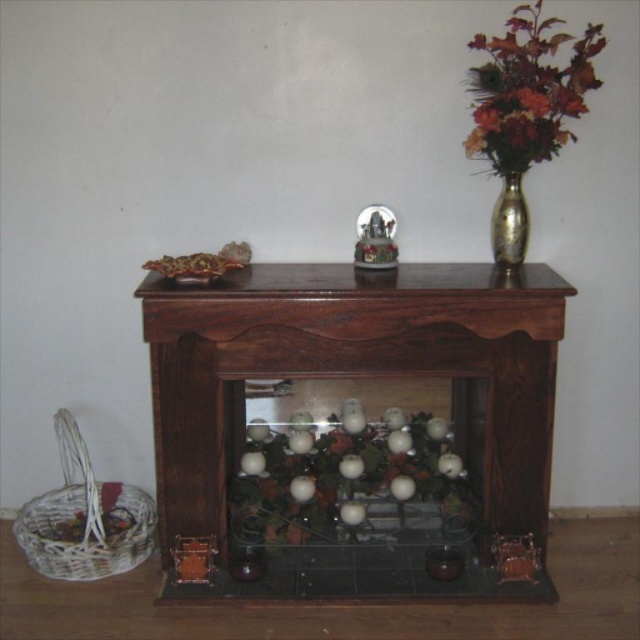
Question: Can you confirm if white matte floral arrangement at center is wider than gold metallic vase at upper right?

Choices:
 (A) no
 (B) yes

Answer: (B)

Question: Which of these objects is positioned closest to the gold metallic vase at upper right?

Choices:
 (A) white matte floral arrangement at center
 (B) multicolored silk bouquet at upper right
 (C) dark wood fireplace at center

Answer: (B)

Question: Estimate the real-world distances between objects in this image. Which object is closer to the dark wood fireplace at center?

Choices:
 (A) multicolored silk bouquet at upper right
 (B) gold metallic vase at upper right
 (C) white matte floral arrangement at center

Answer: (C)

Question: Does dark wood fireplace at center have a smaller size compared to multicolored silk bouquet at upper right?

Choices:
 (A) no
 (B) yes

Answer: (A)

Question: Is white matte floral arrangement at center positioned before multicolored silk bouquet at upper right?

Choices:
 (A) no
 (B) yes

Answer: (A)

Question: Considering the real-world distances, which object is farthest from the multicolored silk bouquet at upper right?

Choices:
 (A) white matte floral arrangement at center
 (B) gold metallic vase at upper right

Answer: (A)